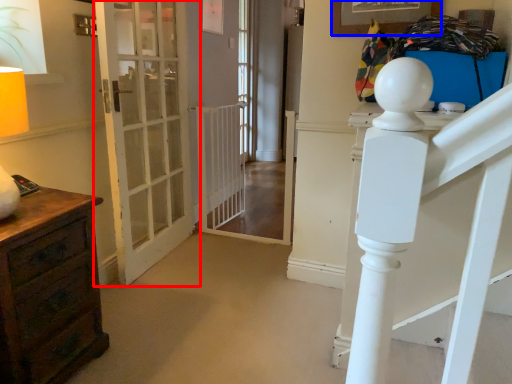
Question: Which of the following is the closest to the observer, door (highlighted by a red box) or picture frame (highlighted by a blue box)?

Choices:
 (A) door
 (B) picture frame

Answer: (B)